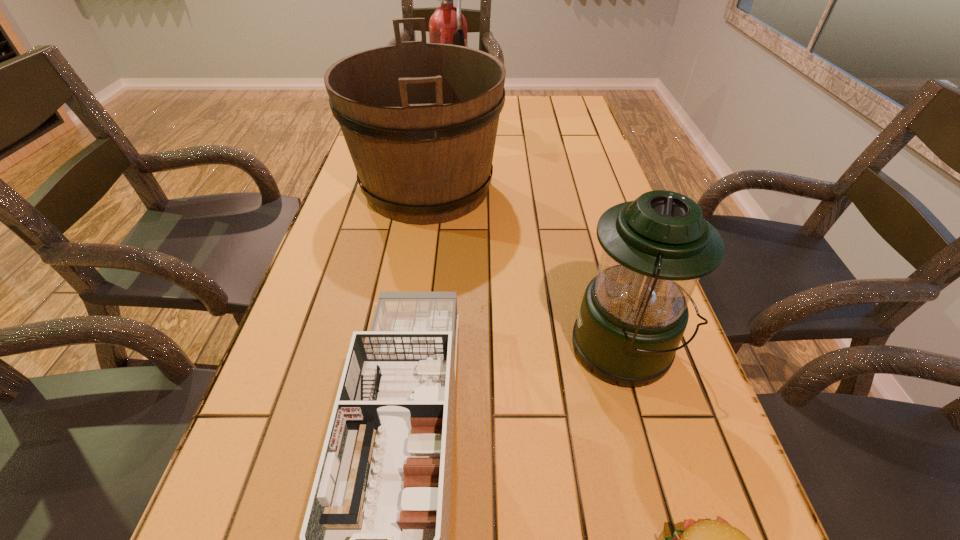
Locate an element on the screen. This screenshot has height=540, width=960. vacant space at the right edge is located at coordinates (597, 181).

Where is `free space at the far right corner`? free space at the far right corner is located at coordinates (567, 123).

The height and width of the screenshot is (540, 960). Find the location of `vacant point located between the second farthest object and the lantern`. vacant point located between the second farthest object and the lantern is located at coordinates (527, 268).

Image resolution: width=960 pixels, height=540 pixels. I want to click on object identified as the closest to the second farthest object, so click(447, 25).

Locate which object ranks second in proximity to the second farthest object. Please provide its 2D coordinates. Your answer should be formatted as a tuple, i.e. [(x, y)], where the tuple contains the x and y coordinates of a point satisfying the conditions above.

[(375, 538)]

Find the location of a particular element. vacant point that satisfies the following two spatial constraints: 1. on the front of the lantern near the operation label; 2. on the left side of the farthest object is located at coordinates click(426, 349).

The height and width of the screenshot is (540, 960). Identify the location of vacant point that satisfies the following two spatial constraints: 1. on the front side of the third tallest object; 2. on the left side of the fourth nearest object. (402, 349).

Find the location of a particular element. The image size is (960, 540). free spot that satisfies the following two spatial constraints: 1. on the front side of the fourth nearest object; 2. on the right side of the third shortest object is located at coordinates (402, 349).